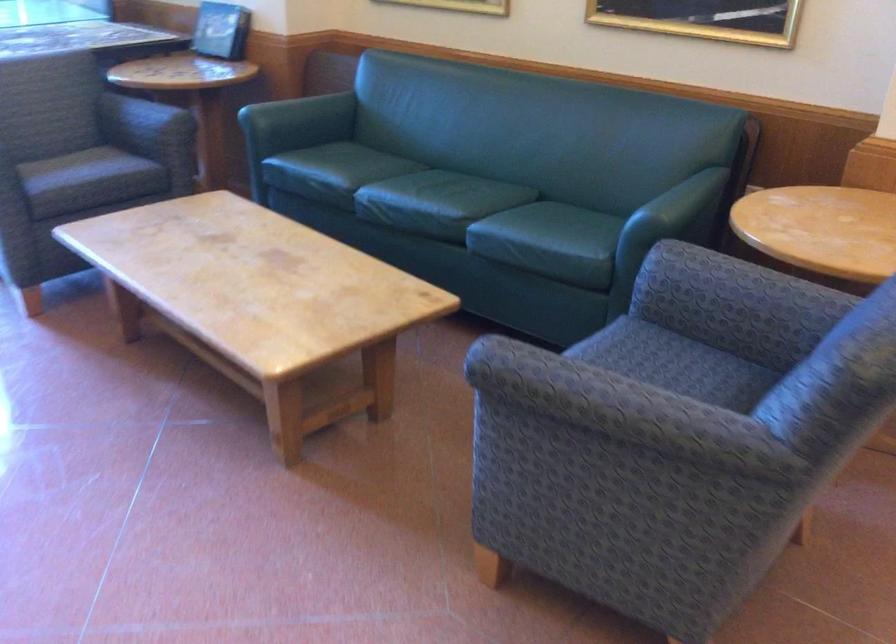
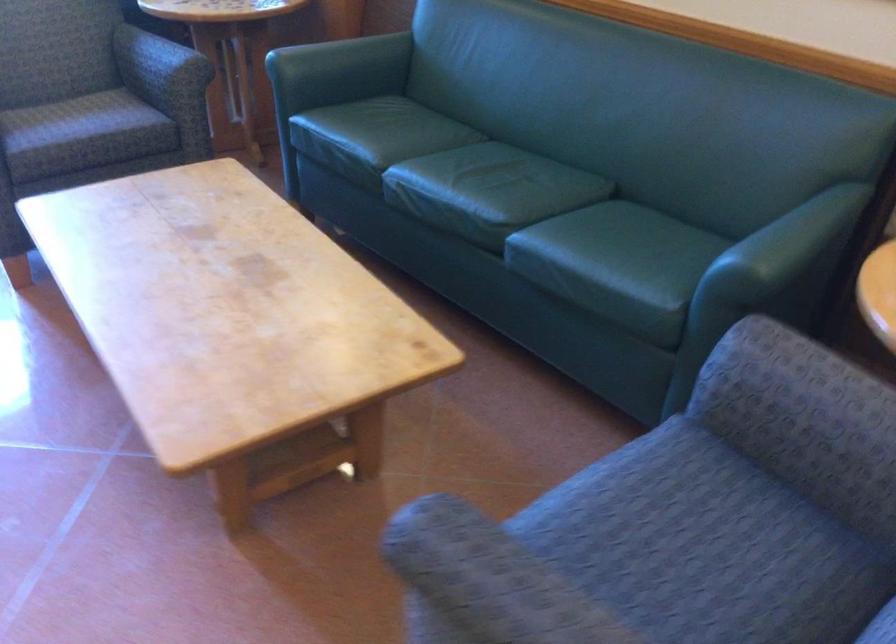
Locate, in the second image, the point that corresponds to point 149,120 in the first image.

(158, 62)